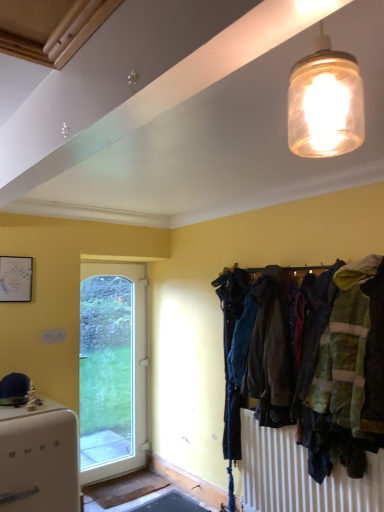
You are a GUI agent. You are given a task and a screenshot of the screen. Output one action in this format:
    pyautogui.click(x=<x>, y=<y>)
    Task: Click on the free space in front of white glossy door at left
    
    Given the screenshot: What is the action you would take?
    pyautogui.click(x=109, y=490)